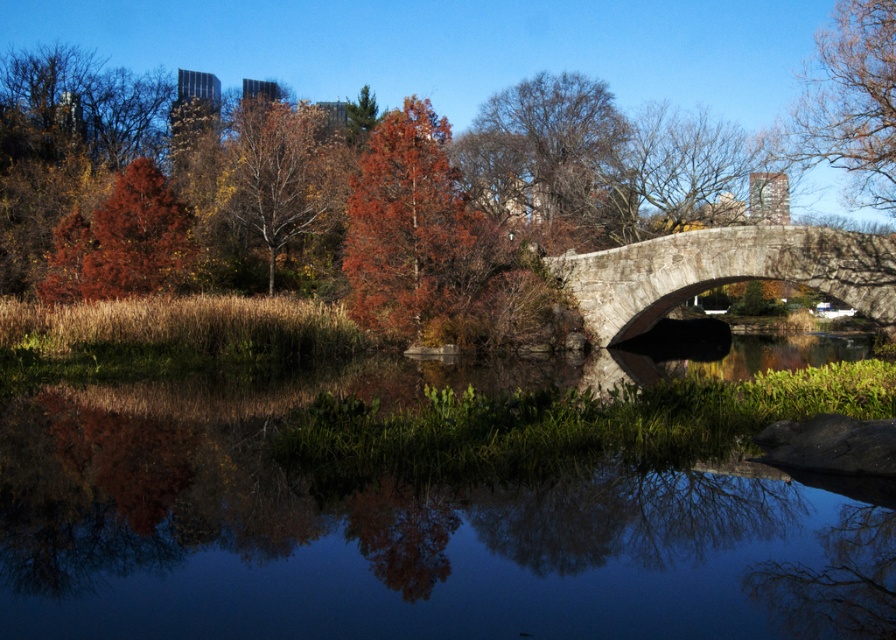
You are standing at point (724, 272) in the image. What object is located exactly at this point?

The gray stone bridge at right is located exactly at point (724, 272).

You are standing at the center of the image and want to cross the gray stone bridge at right. In which direction should you walk to reach it?

Since the gray stone bridge at right is located at point (724, 272) in 2D coordinates, you should walk towards the right side of the image to reach it.